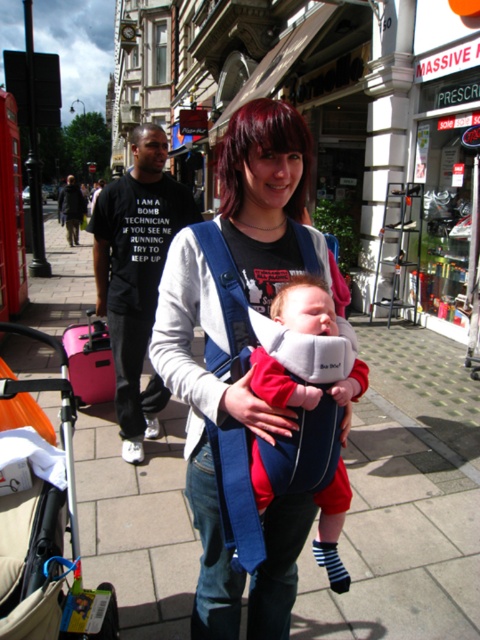
Question: Among these points, which one is farthest from the camera?

Choices:
 (A) (479, 387)
 (B) (285, 380)

Answer: (A)

Question: Can you confirm if paved stone sidewalk at center is wider than soft cotton baby at center?

Choices:
 (A) yes
 (B) no

Answer: (A)

Question: Can you confirm if pink fabric baby carriage at lower left is bigger than soft cotton baby at center?

Choices:
 (A) yes
 (B) no

Answer: (A)

Question: Does pink fabric baby carriage at lower left appear over soft cotton baby at center?

Choices:
 (A) no
 (B) yes

Answer: (A)

Question: Which object is closer to the camera taking this photo?

Choices:
 (A) soft cotton baby at center
 (B) pink fabric baby carriage at lower left
 (C) matte blue baby carrier at center
 (D) paved stone sidewalk at center

Answer: (B)

Question: Which point is closer to the camera?

Choices:
 (A) (420, 369)
 (B) (10, 449)

Answer: (B)